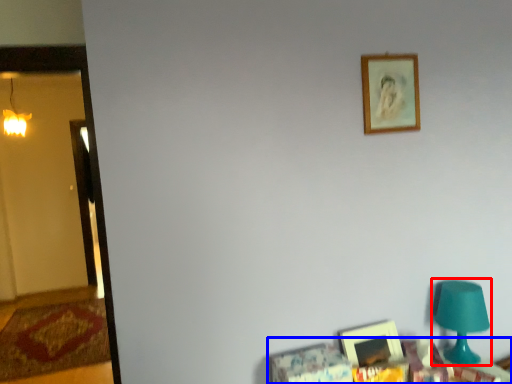
Question: Which point is closer to the camera, table lamp (highlighted by a red box) or furniture (highlighted by a blue box)?

Choices:
 (A) table lamp
 (B) furniture

Answer: (B)